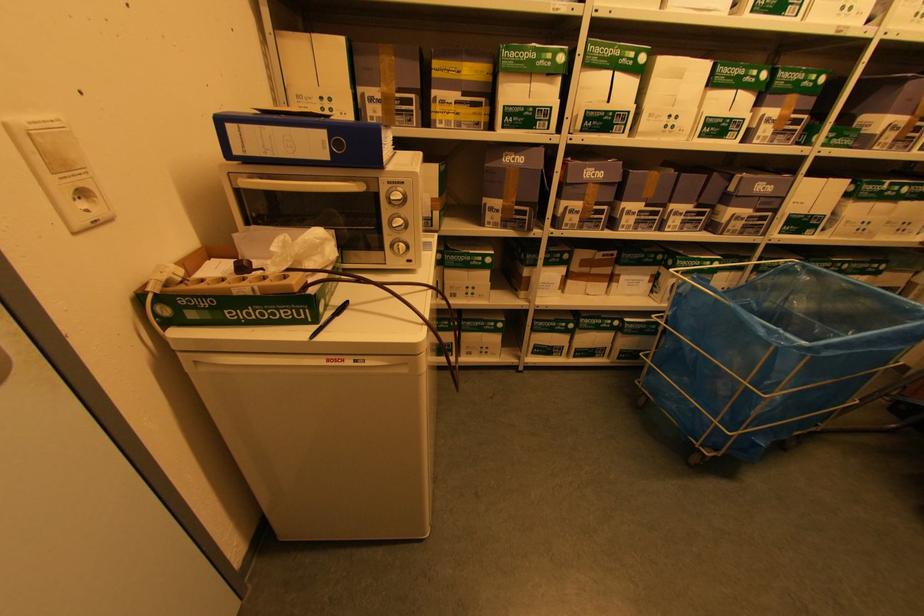
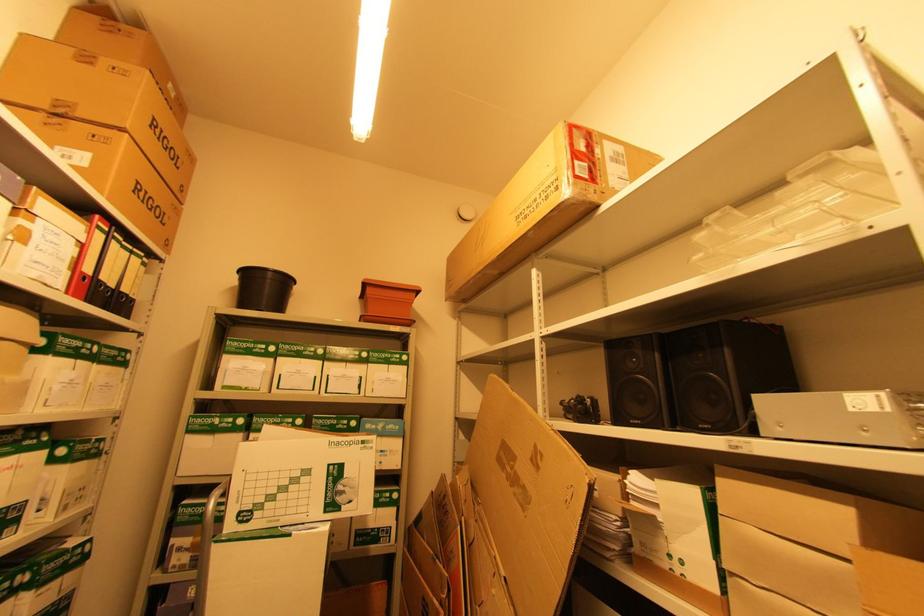
Question: The images are taken continuously from a first-person perspective. In which direction is your viewpoint rotating?

Choices:
 (A) Left
 (B) Right
 (C) Up
 (D) Down

Answer: (B)